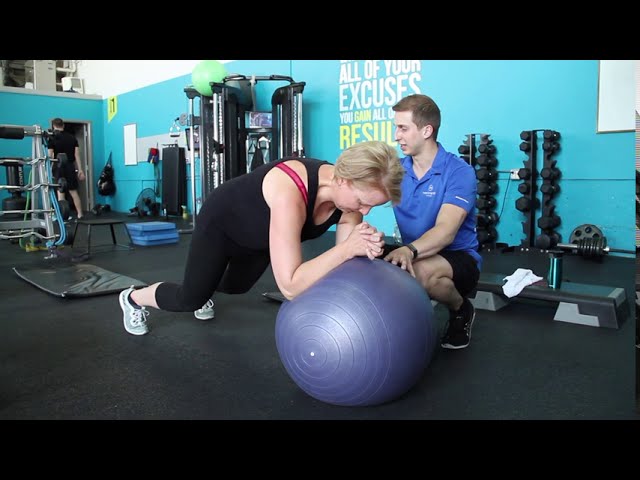
Identify the location of yoga mat. The width and height of the screenshot is (640, 480). coord(65,278).